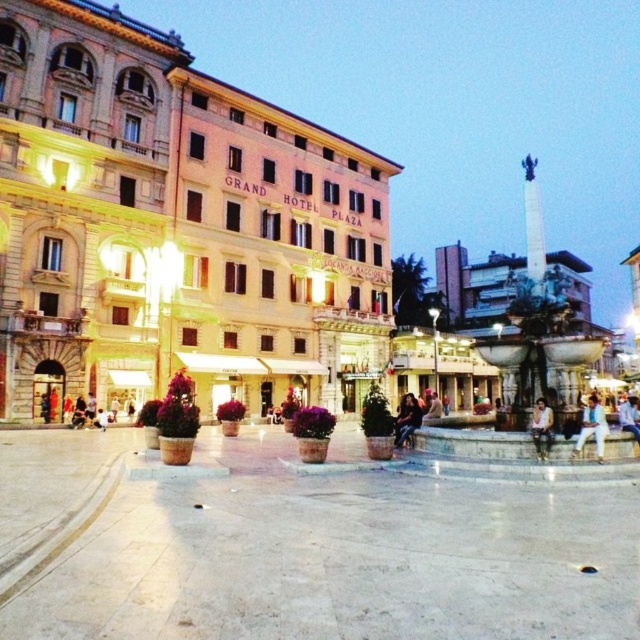
Based on the photo, is white marble fountain at center above white cotton shirt at lower right?

Yes, white marble fountain at center is above white cotton shirt at lower right.

Does white marble fountain at center appear on the left side of white cotton shirt at lower right?

In fact, white marble fountain at center is to the right of white cotton shirt at lower right.

Between point (486, 444) and point (589, 394), which one is positioned in front?

Point (486, 444)

At what (x,y) coordinates should I click in order to perform the action: click on white marble fountain at center. Please return your answer as a coordinate pair (x, y). This screenshot has width=640, height=640. Looking at the image, I should click on (532, 371).

Does white marble fountain at center appear over dark brown leather jacket at center?

Yes, white marble fountain at center is above dark brown leather jacket at center.

Can you confirm if white marble fountain at center is thinner than dark brown leather jacket at center?

No.

You are a GUI agent. You are given a task and a screenshot of the screen. Output one action in this format:
    pyautogui.click(x=<x>, y=<y>)
    Task: Click on the white marble fountain at center
    
    Given the screenshot: What is the action you would take?
    pyautogui.click(x=532, y=371)

Between point (595, 435) and point (636, 397), which one is positioned behind?

The point (636, 397) is more distant.

Between white cotton shirt at lower right and blue denim jeans at lower right, which one is positioned lower?

Positioned lower is blue denim jeans at lower right.

What do you see at coordinates (593, 428) in the screenshot? Image resolution: width=640 pixels, height=640 pixels. I see `white cotton shirt at lower right` at bounding box center [593, 428].

The width and height of the screenshot is (640, 640). Find the location of `white cotton shirt at lower right`. white cotton shirt at lower right is located at coordinates tap(593, 428).